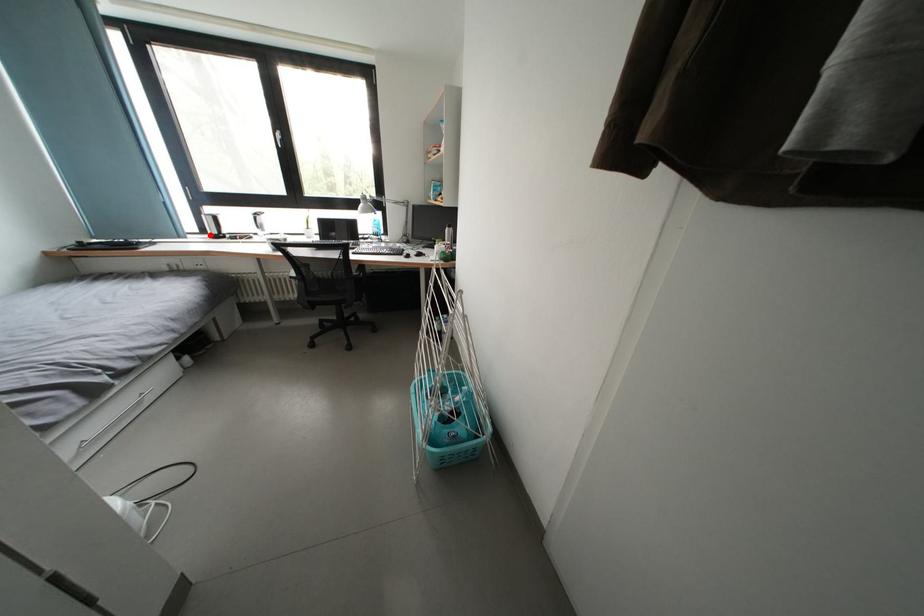
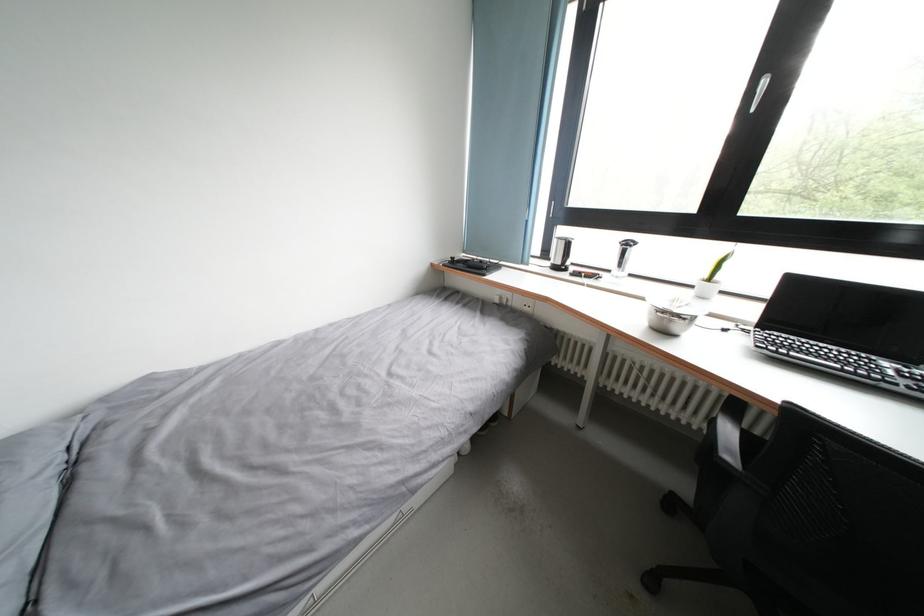
Where in the second image is the point corresponding to the highlighted location from the first image?

(552, 259)